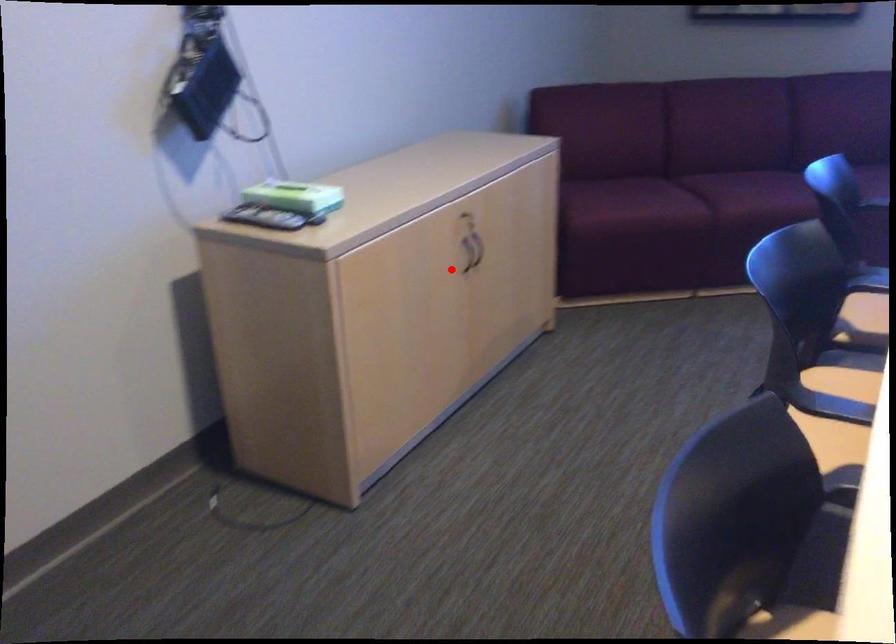
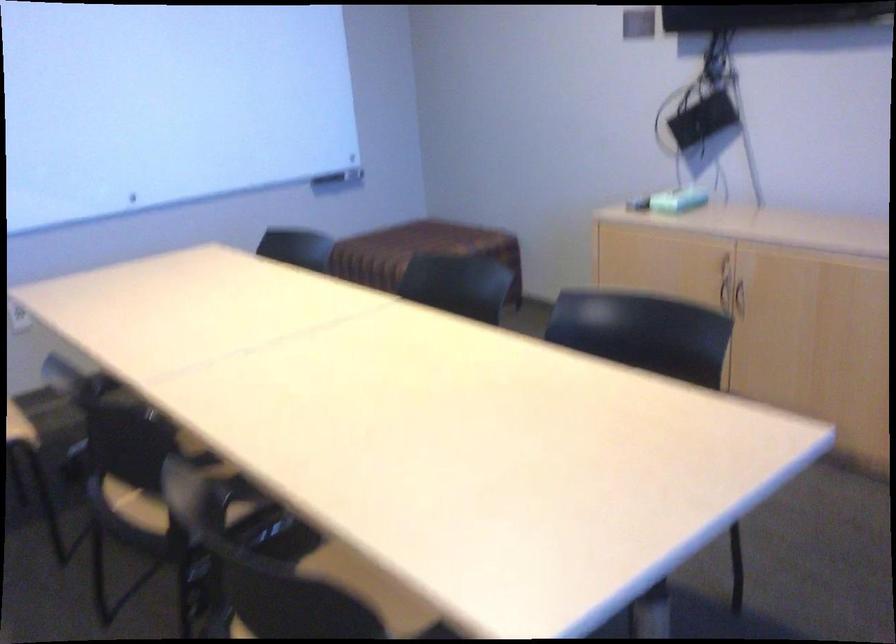
Question: I am providing you with two images of the same scene from different viewpoints. In image1, a red point is highlighted. Considering the same 3D point in image2, which of the following is correct?

Choices:
 (A) It is closer
 (B) It is farther

Answer: (B)